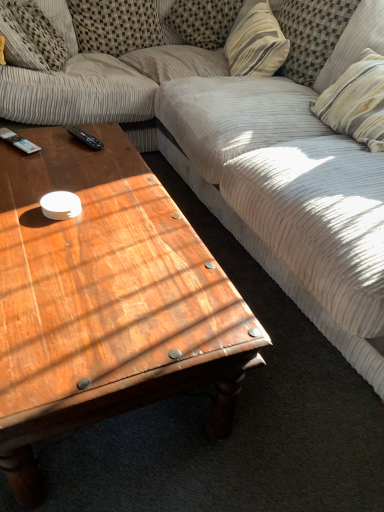
The width and height of the screenshot is (384, 512). In order to click on unoccupied area behind black plastic remote at center, placed as the 1th remote control when sorted from right to left in this screenshot , I will do `click(97, 132)`.